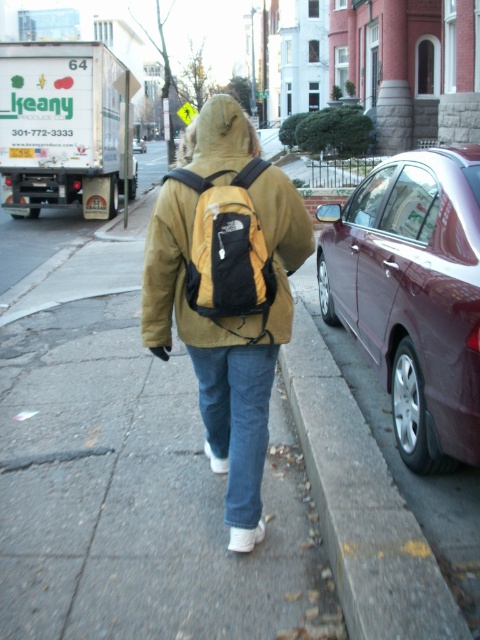
You are standing at the camera position and want to throw a ball to someone standing 3 meters away from you. Is the matte yellow jacket at center within your throwing range?

The matte yellow jacket at center is 2.60 meters away from the camera, so yes, it is within the 3 meters throwing range.

You are standing on the sidewalk and see the shiny maroon sedan at right. What are the coordinates of the shiny maroun sedan at right?

The coordinates of the shiny maroon sedan at right are at point (414, 294).

You are standing at the starting point of the sidewalk and want to reach the matte yellow jacket at center. Which direction should you move relative to the parked maroon sedan on the right?

The matte yellow jacket at center is located at point (172, 275), so you should move towards the direction where the parked maroon sedan is on your right side.